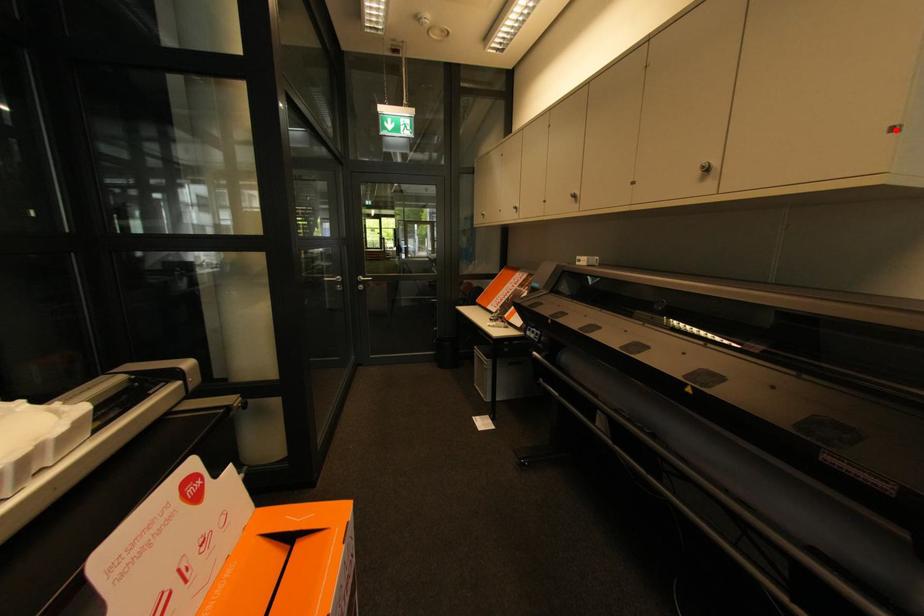
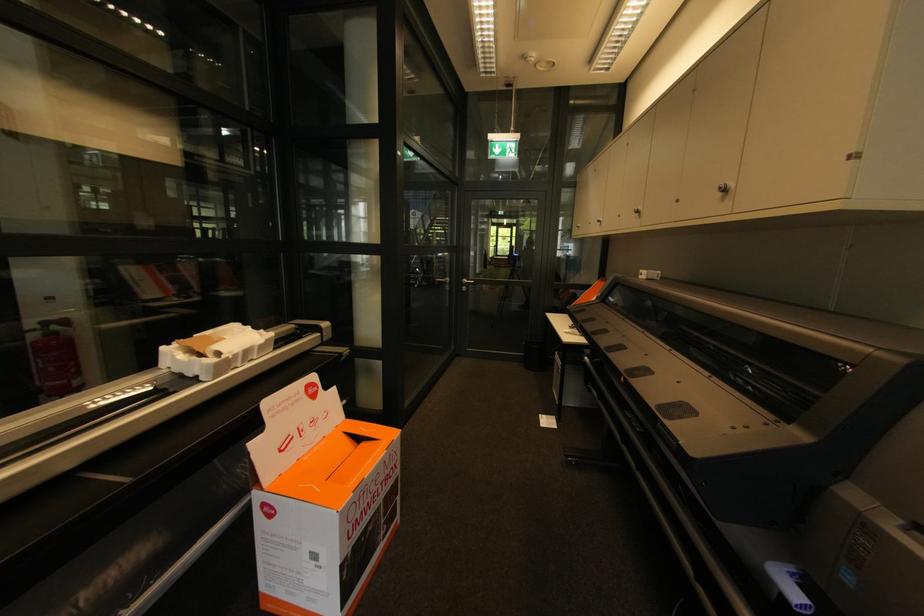
Locate, in the second image, the point that corresponds to the highlighted location in the first image.

(857, 156)